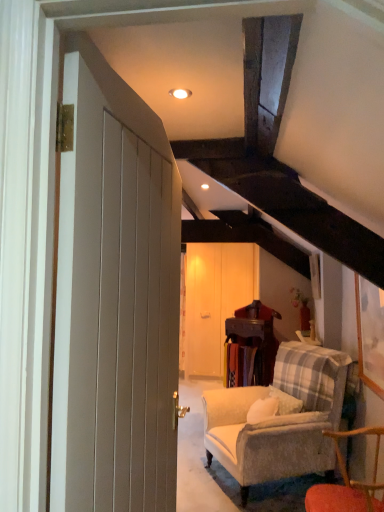
Question: Could you tell me if wooden barn door at center is turned towards matte white door at left?

Choices:
 (A) no
 (B) yes

Answer: (B)

Question: Is the position of wooden barn door at center more distant than that of matte white door at left?

Choices:
 (A) yes
 (B) no

Answer: (A)

Question: Can you confirm if wooden barn door at center is positioned to the left of matte white door at left?

Choices:
 (A) yes
 (B) no

Answer: (B)

Question: From the image's perspective, is wooden barn door at center above matte white door at left?

Choices:
 (A) no
 (B) yes

Answer: (A)

Question: Could matte white door at left be considered to be inside wooden barn door at center?

Choices:
 (A) yes
 (B) no

Answer: (B)

Question: Considering the positions of point (238, 343) and point (64, 421), is point (238, 343) closer or farther from the camera than point (64, 421)?

Choices:
 (A) closer
 (B) farther

Answer: (B)

Question: Is wooden table at center wider or thinner than matte white door at left?

Choices:
 (A) thin
 (B) wide

Answer: (B)

Question: From the image's perspective, is wooden table at center above or below matte white door at left?

Choices:
 (A) above
 (B) below

Answer: (B)

Question: In the image, is wooden table at center on the left side or the right side of matte white door at left?

Choices:
 (A) right
 (B) left

Answer: (A)

Question: Does point (322, 508) appear closer or farther from the camera than point (213, 372)?

Choices:
 (A) closer
 (B) farther

Answer: (A)

Question: From the image's perspective, is wooden chair at lower right located above or below wooden barn door at center?

Choices:
 (A) below
 (B) above

Answer: (A)

Question: Would you say wooden chair at lower right is to the left or to the right of wooden barn door at center in the picture?

Choices:
 (A) left
 (B) right

Answer: (B)

Question: Based on their sizes in the image, would you say wooden chair at lower right is bigger or smaller than wooden barn door at center?

Choices:
 (A) small
 (B) big

Answer: (A)

Question: Visually, is wooden table at center positioned to the left or to the right of wooden chair at lower right?

Choices:
 (A) left
 (B) right

Answer: (A)

Question: Considering the positions of wooden table at center and wooden chair at lower right in the image, is wooden table at center bigger or smaller than wooden chair at lower right?

Choices:
 (A) small
 (B) big

Answer: (A)